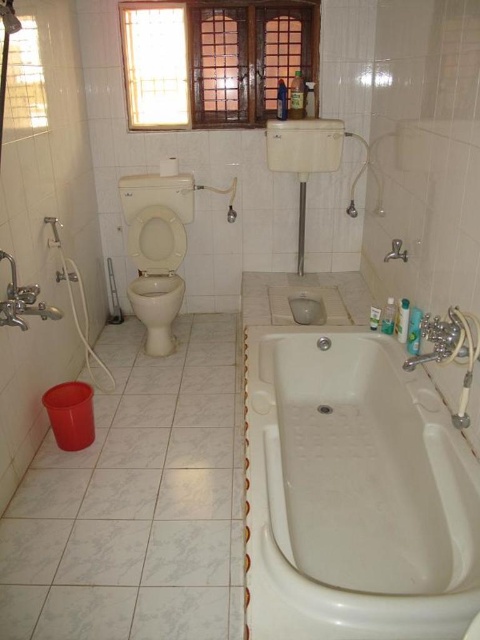
You are standing in the bathroom and need to reach the white glossy bathtub at lower right. Based on the layout described, where should you move relative to the toilet?

The white glossy bathtub at lower right is located at point [352,493], which means it is positioned to the right and slightly below the center of the bathroom. To reach it, move towards the right side of the toilet.

You are standing in the bathroom and want to reach the point marked at coordinates (264, 387). If you are currently 2 meters away from it, can you take a single step forward to reach that point?

The point marked at coordinates (264, 387) is 2.07 meters away from the camera. Since you are currently 2 meters away, you are already closer than the required distance. Therefore, taking a step forward might overshoot the point. You should move backward slightly instead.